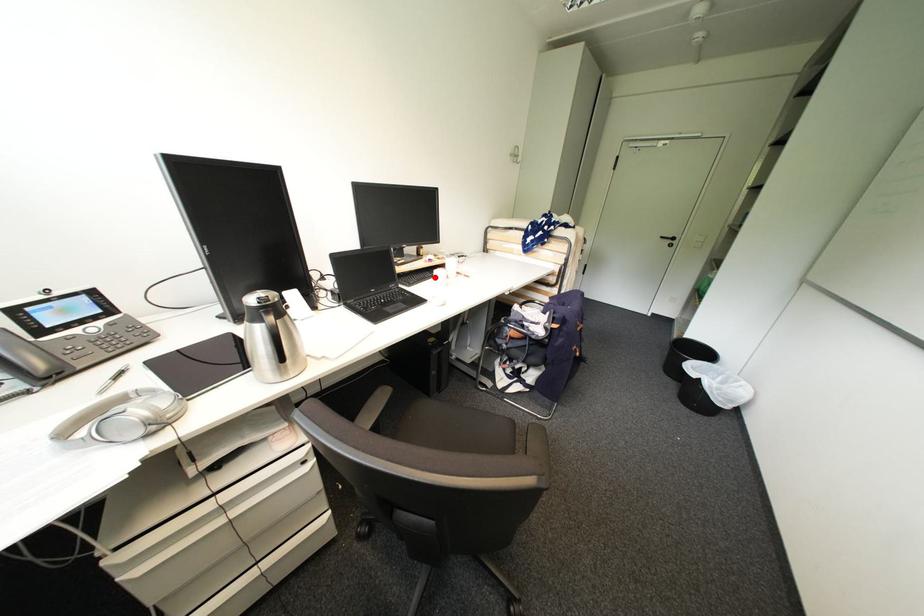
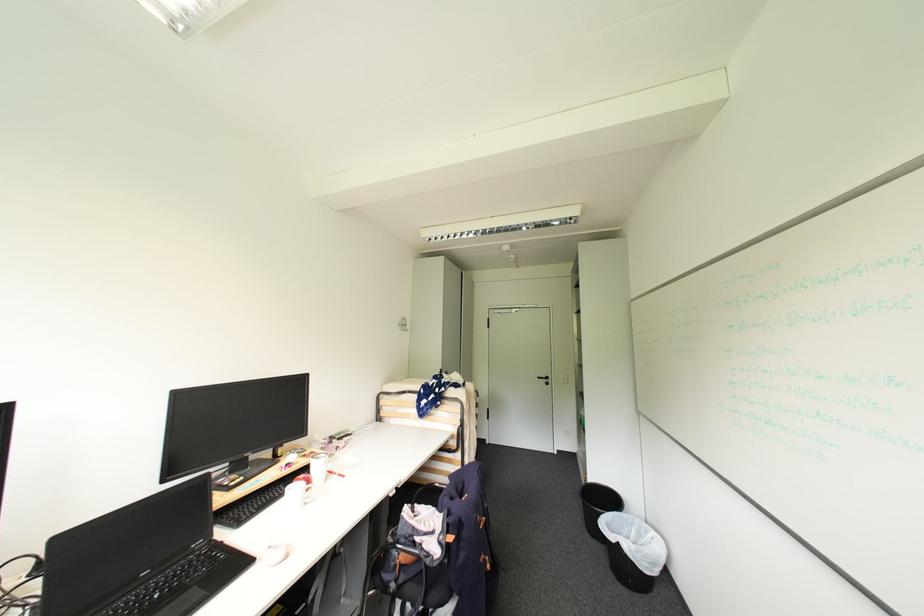
In the second image, find the point that corresponds to the highlighted location in the first image.

(286, 495)